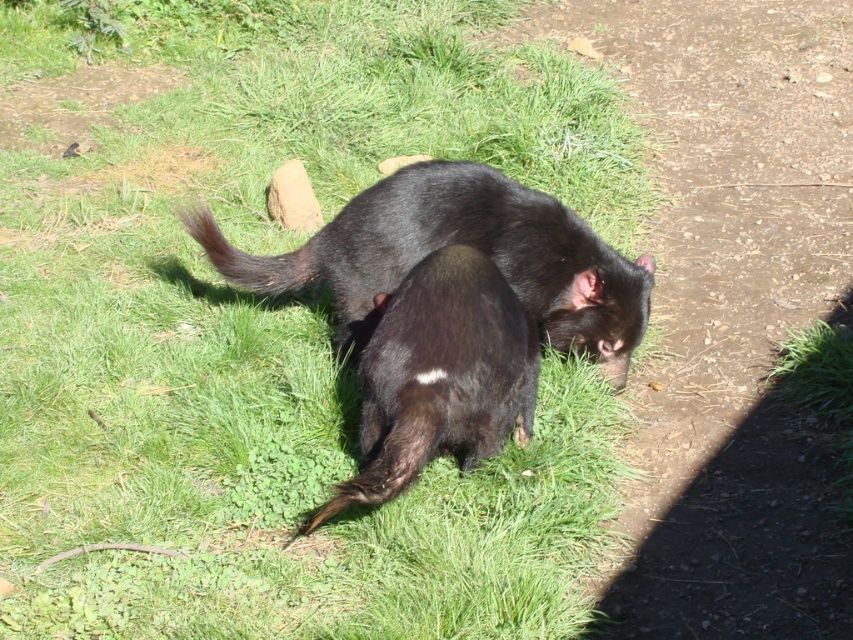
You are a wildlife photographer trying to capture a closeup of the black furry tasmanian devil at center. Your camera has a minimum focusing distance of 2 meters. Can you take the photo without moving closer than 2 meters?

The black furry tasmanian devil at center is 2.69 meters away, which is beyond the camera minimum focusing distance of 2 meters. Yes, you can take the photo without moving closer than 2 meters.